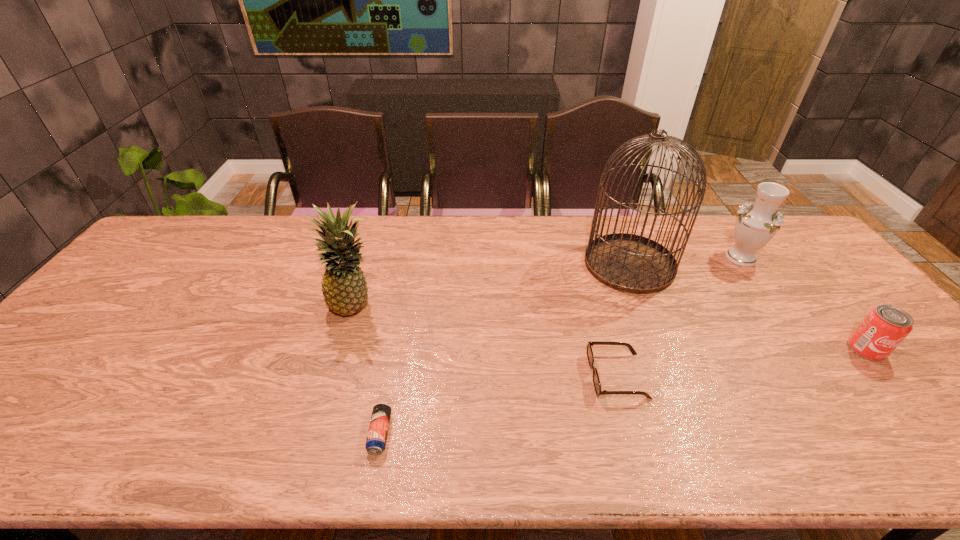
The image size is (960, 540). I want to click on empty space that is in between the birdcage and the vase, so pyautogui.click(x=685, y=261).

Where is `vacant area between the birdcage and the fourth tallest object`? This screenshot has height=540, width=960. vacant area between the birdcage and the fourth tallest object is located at coordinates point(748,307).

Locate an element on the screen. unoccupied area between the sunglasses and the shortest object is located at coordinates (498, 404).

Find the location of a particular element. The height and width of the screenshot is (540, 960). free space between the birdcage and the second shortest object is located at coordinates (623, 320).

Locate an element on the screen. free spot between the rightmost object and the leftmost object is located at coordinates (611, 328).

Where is `the closest object to the pineapple`? The width and height of the screenshot is (960, 540). the closest object to the pineapple is located at coordinates (377, 434).

Where is `object identified as the second closest to the tallest object`? Image resolution: width=960 pixels, height=540 pixels. object identified as the second closest to the tallest object is located at coordinates (596, 381).

This screenshot has height=540, width=960. In order to click on free space that satisfies the following two spatial constraints: 1. on the back side of the third tallest object; 2. on the left side of the birdcage in this screenshot , I will do `click(627, 258)`.

Where is `vacant space that satisfies the following two spatial constraints: 1. on the front side of the pineapple; 2. on the right side of the beer can`? This screenshot has height=540, width=960. vacant space that satisfies the following two spatial constraints: 1. on the front side of the pineapple; 2. on the right side of the beer can is located at coordinates (317, 434).

Locate an element on the screen. free space that satisfies the following two spatial constraints: 1. on the back side of the vase; 2. on the right side of the birdcage is located at coordinates (627, 258).